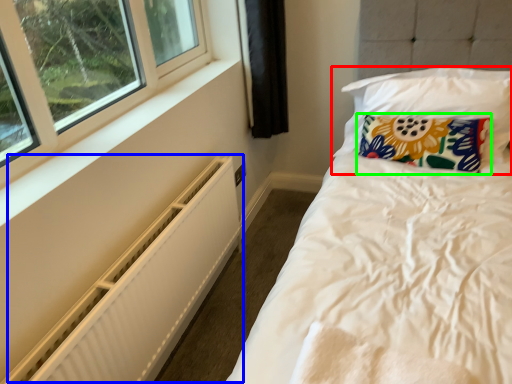
Question: Estimate the real-world distances between objects in this image. Which object is closer to pillow (highlighted by a red box), radiator (highlighted by a blue box) or pillow (highlighted by a green box)?

Choices:
 (A) radiator
 (B) pillow

Answer: (B)